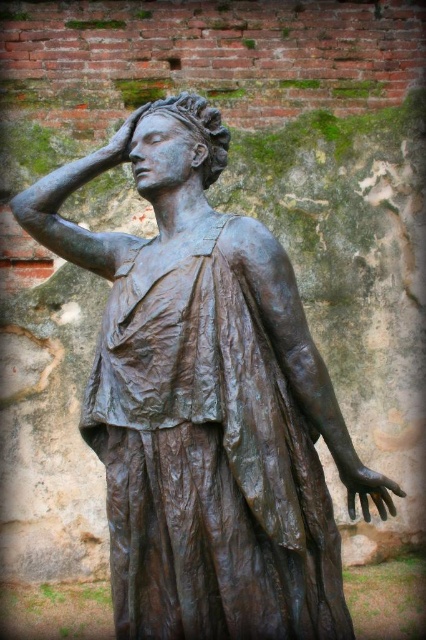
Who is higher up, bronze statue head at center or bronze hand at upper center?

Positioned higher is bronze hand at upper center.

Is bronze statue head at center bigger than bronze hand at upper center?

Yes.

Where is `bronze statue head at center`? The height and width of the screenshot is (640, 426). bronze statue head at center is located at coordinates (195, 129).

Find the location of a particular element. The height and width of the screenshot is (640, 426). bronze statue head at center is located at coordinates (195, 129).

Is bronze hand at center wider than bronze hand at upper center?

Yes, bronze hand at center is wider than bronze hand at upper center.

Which is more to the right, bronze hand at center or bronze hand at upper center?

bronze hand at center

The width and height of the screenshot is (426, 640). What do you see at coordinates (365, 484) in the screenshot?
I see `bronze hand at center` at bounding box center [365, 484].

Identify the location of bronze hand at center. (365, 484).

From the picture: Is bronze statue head at center further to the viewer compared to bronze hand at center?

Yes.

Can you confirm if bronze statue head at center is wider than bronze hand at center?

Yes.

Which is in front, point (164, 108) or point (348, 474)?

Point (348, 474) is more forward.

The height and width of the screenshot is (640, 426). I want to click on bronze statue head at center, so click(x=195, y=129).